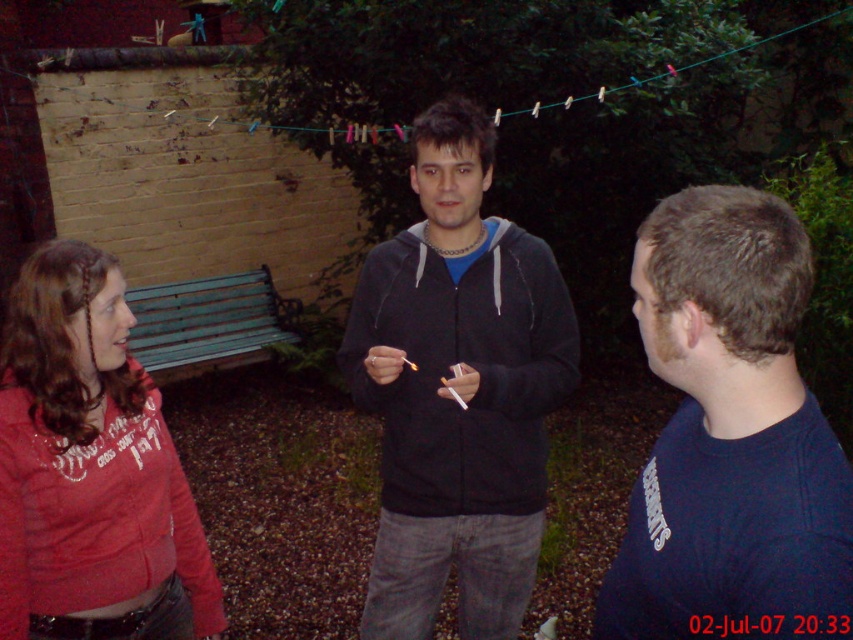
Question: Where is dark blue sweater at right located in relation to matte red hoodie at left in the image?

Choices:
 (A) left
 (B) right

Answer: (B)

Question: Which of the following is the closest to the observer?

Choices:
 (A) (88, 634)
 (B) (497, 291)

Answer: (A)

Question: Which of the following is the farthest from the observer?

Choices:
 (A) dark gray hoodie at center
 (B) dark blue sweater at right

Answer: (A)

Question: Does dark blue sweater at right appear under dark gray hoodie at center?

Choices:
 (A) yes
 (B) no

Answer: (B)

Question: Is dark gray hoodie at center wider than matte red hoodie at left?

Choices:
 (A) no
 (B) yes

Answer: (B)

Question: Estimate the real-world distances between objects in this image. Which object is farther from the matte red hoodie at left?

Choices:
 (A) dark gray hoodie at center
 (B) dark blue sweater at right

Answer: (B)